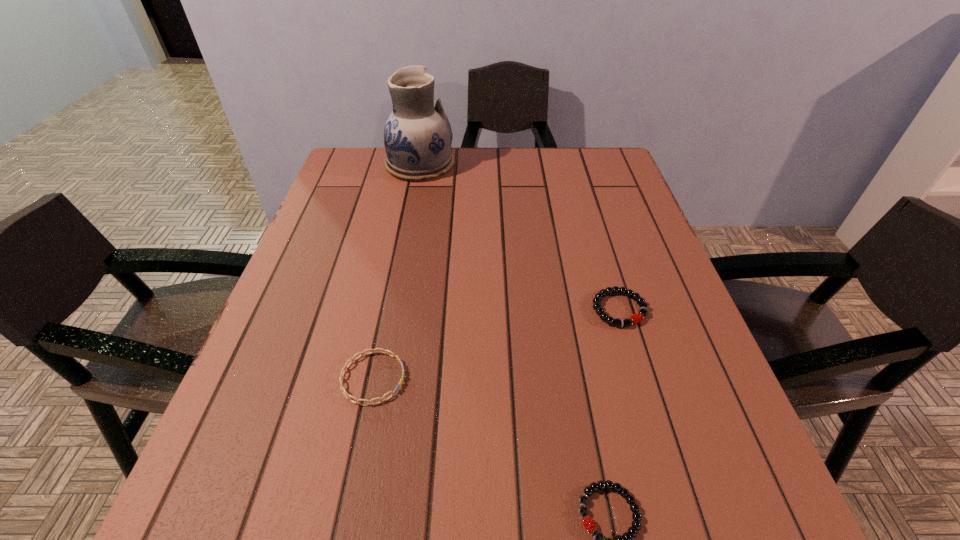
Where is `free location that satisfies the following two spatial constraints: 1. on the front side of the rightmost bracelet; 2. on the surface of the second nearest bracelet showing star-shaped elements`? Image resolution: width=960 pixels, height=540 pixels. free location that satisfies the following two spatial constraints: 1. on the front side of the rightmost bracelet; 2. on the surface of the second nearest bracelet showing star-shaped elements is located at coordinates (640, 378).